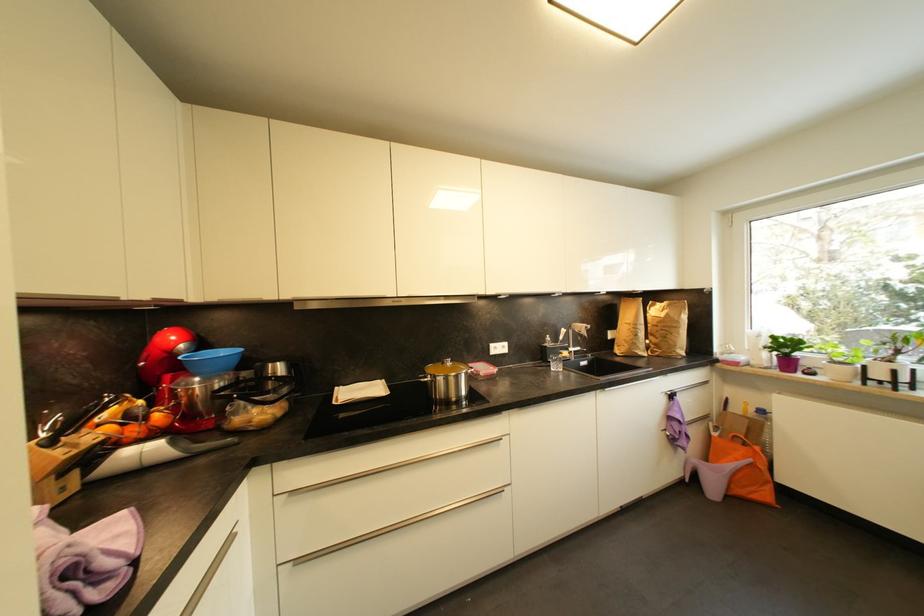
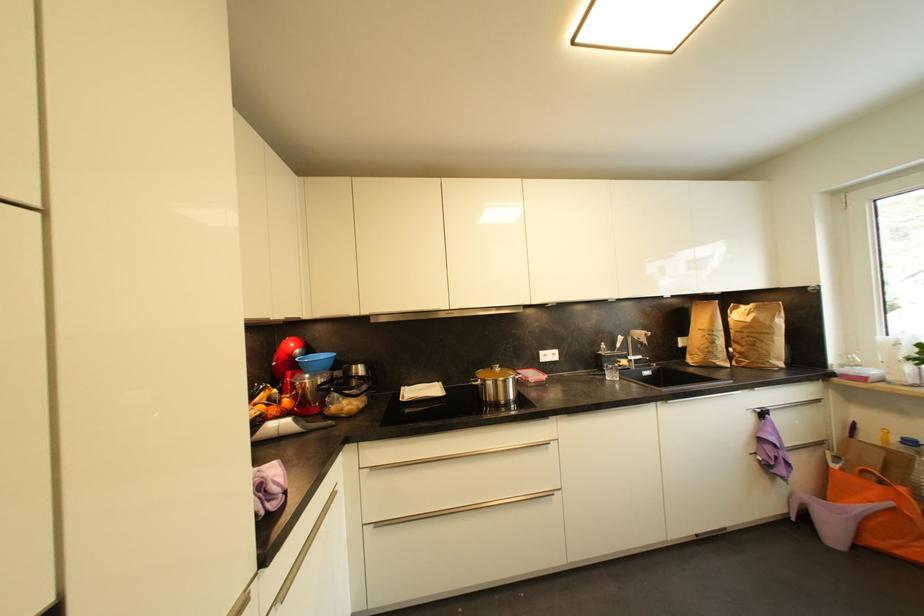
Where in the second image is the point corresponding to (561,369) from the first image?

(616, 378)